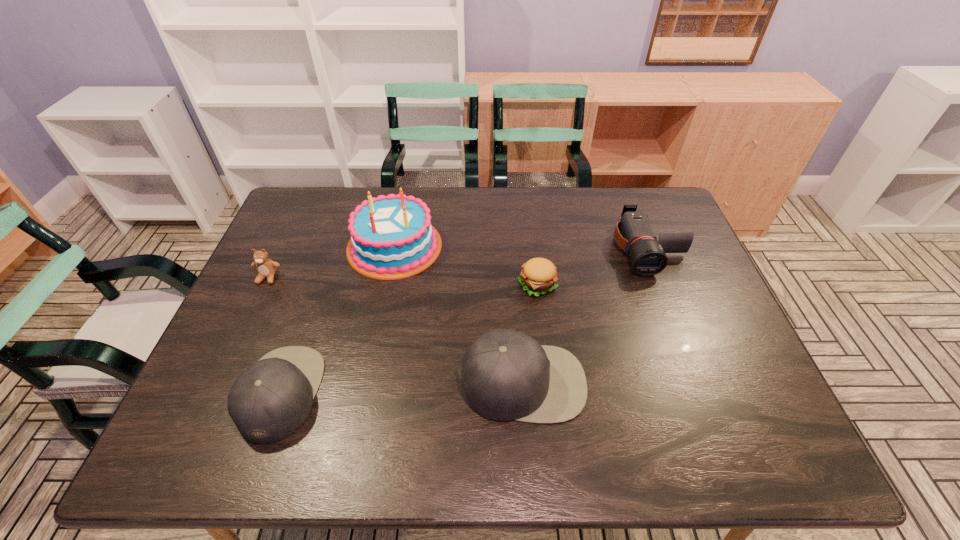
Please point a spot to add another cap on the right. Please provide its 2D coordinates. Your answer should be formatted as a tuple, i.e. [(x, y)], where the tuple contains the x and y coordinates of a point satisfying the conditions above.

[(755, 373)]